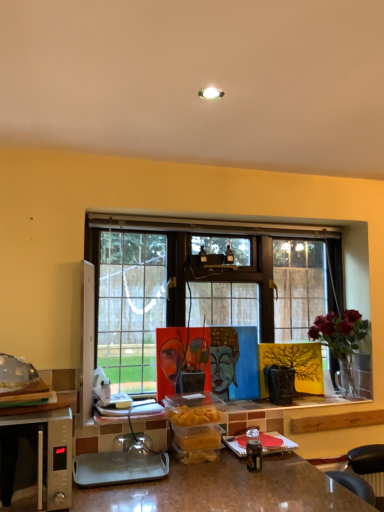
Question: From the image's perspective, is silver metallic microwave oven at lower left located above or below deep red flowers in glass vase at right?

Choices:
 (A) above
 (B) below

Answer: (B)

Question: From a real-world perspective, is silver metallic microwave oven at lower left above or below deep red flowers in glass vase at right?

Choices:
 (A) below
 (B) above

Answer: (A)

Question: Estimate the real-world distances between objects in this image. Which object is farther from the translucent glass food at left?

Choices:
 (A) deep red flowers in glass vase at right
 (B) silver metallic microwave oven at lower left

Answer: (A)

Question: Which is farther from the silver metallic microwave oven at lower left?

Choices:
 (A) translucent glass food at left
 (B) deep red flowers in glass vase at right

Answer: (B)